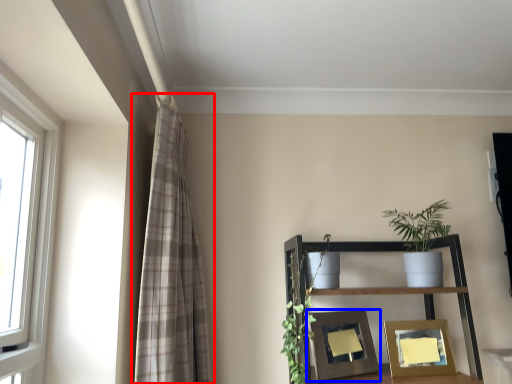
Question: Which point is closer to the camera, curtain (highlighted by a red box) or picture frame (highlighted by a blue box)?

Choices:
 (A) curtain
 (B) picture frame

Answer: (A)